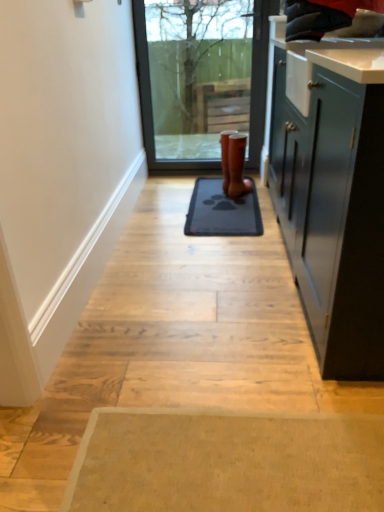
Image resolution: width=384 pixels, height=512 pixels. Identify the location of transparent glass door at center. (201, 78).

Between brown leather boot at center and gray rubber mat at center, which one appears on the left side from the viewer's perspective?

Positioned to the left is gray rubber mat at center.

Are brown leather boot at center and gray rubber mat at center beside each other?

No, brown leather boot at center is not next to gray rubber mat at center.

From the image's perspective, is brown leather boot at center under gray rubber mat at center?

No.

Measure the distance between gray rubber mat at center and brown leather boot at center.

gray rubber mat at center and brown leather boot at center are 9.33 inches apart.

Consider the image. Can you tell me how much gray rubber mat at center and brown leather boot at center differ in facing direction?

The facing directions of gray rubber mat at center and brown leather boot at center are 31.6 degrees apart.

Is gray rubber mat at center looking in the opposite direction of brown leather boot at center?

gray rubber mat at center does not have its back to brown leather boot at center.

From a real-world perspective, is gray rubber mat at center located higher than brown leather boot at center?

No, from a real-world perspective, gray rubber mat at center is not on top of brown leather boot at center.

Locate an element on the screen. This screenshot has height=512, width=384. window above the brown leather boot at center (from a real-world perspective) is located at coordinates (201, 78).

Between brown leather boot at center and transparent glass door at center, which one has less height?

Standing shorter between the two is brown leather boot at center.

Considering the relative positions of brown leather boot at center and transparent glass door at center in the image provided, is brown leather boot at center to the left of transparent glass door at center from the viewer's perspective?

No.

Would you say brown leather boot at center is inside or outside transparent glass door at center?

brown leather boot at center lies outside transparent glass door at center.

From the image's perspective, would you say gray rubber mat at center is positioned over transparent glass door at center?

No, from the image's perspective, gray rubber mat at center is not on top of transparent glass door at center.

From a real-world perspective, is gray rubber mat at center beneath transparent glass door at center?

Yes.

Consider the image. In the image, is gray rubber mat at center positioned in front of or behind transparent glass door at center?

gray rubber mat at center is in front of transparent glass door at center.

Is transparent glass door at center turned away from brown leather boot at center?

transparent glass door at center does not have its back to brown leather boot at center.

Does transparent glass door at center contain brown leather boot at center?

Definitely not — brown leather boot at center is not inside transparent glass door at center.

Is transparent glass door at center shorter than brown leather boot at center?

In fact, transparent glass door at center may be taller than brown leather boot at center.

From the image's perspective, who appears lower, transparent glass door at center or gray rubber mat at center?

gray rubber mat at center, from the image's perspective.

Is transparent glass door at center not close to gray rubber mat at center?

No.

Which is further, (185,27) or (187,220)?

Positioned behind is point (185,27).

Based on the photo, can you confirm if transparent glass door at center is positioned to the right of gray rubber mat at center?

In fact, transparent glass door at center is to the left of gray rubber mat at center.

This screenshot has height=512, width=384. I want to click on footwear above the gray rubber mat at center (from the image's perspective), so click(237, 166).

The width and height of the screenshot is (384, 512). What are the coordinates of `footwear that is on the right side of gray rubber mat at center` in the screenshot? It's located at (237, 166).

Considering their positions, is brown leather boot at center positioned closer to gray rubber mat at center than transparent glass door at center?

The object closer to gray rubber mat at center is brown leather boot at center.

When comparing their distances from brown leather boot at center, does gray rubber mat at center or transparent glass door at center seem further?

transparent glass door at center.

From the image, which object appears to be farther from transparent glass door at center, brown leather boot at center or gray rubber mat at center?

The object further to transparent glass door at center is brown leather boot at center.

Which object lies further to the anchor point brown leather boot at center, transparent glass door at center or gray rubber mat at center?

Among the two, transparent glass door at center is located further to brown leather boot at center.

From the image, which object appears to be farther from transparent glass door at center, gray rubber mat at center or brown leather boot at center?

brown leather boot at center is further to transparent glass door at center.

Looking at the image, which one is located closer to gray rubber mat at center, transparent glass door at center or brown leather boot at center?

The object closer to gray rubber mat at center is brown leather boot at center.

In order to click on footwear that lies between transparent glass door at center and gray rubber mat at center from top to bottom in this screenshot , I will do `click(237, 166)`.